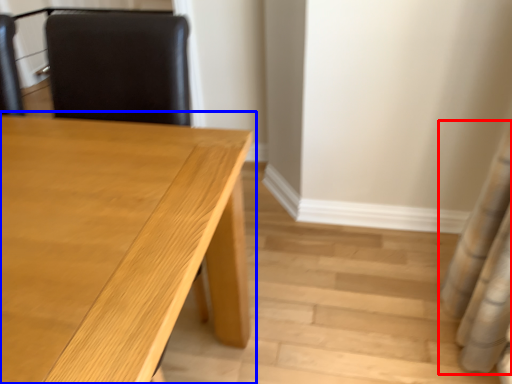
Question: Among these objects, which one is nearest to the camera, shower curtain (highlighted by a red box) or table (highlighted by a blue box)?

Choices:
 (A) shower curtain
 (B) table

Answer: (B)